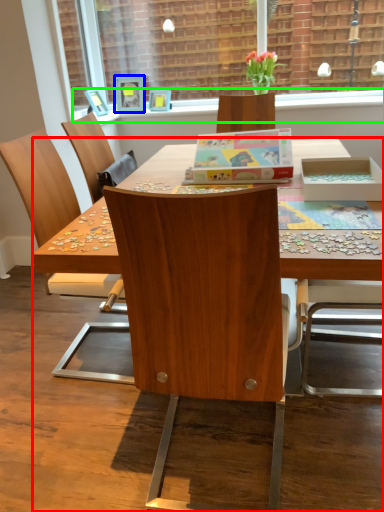
Question: Which object is positioned farthest from desk (highlighted by a red box)? Select from picture frame (highlighted by a blue box) and window sill (highlighted by a green box).

Choices:
 (A) picture frame
 (B) window sill

Answer: (A)